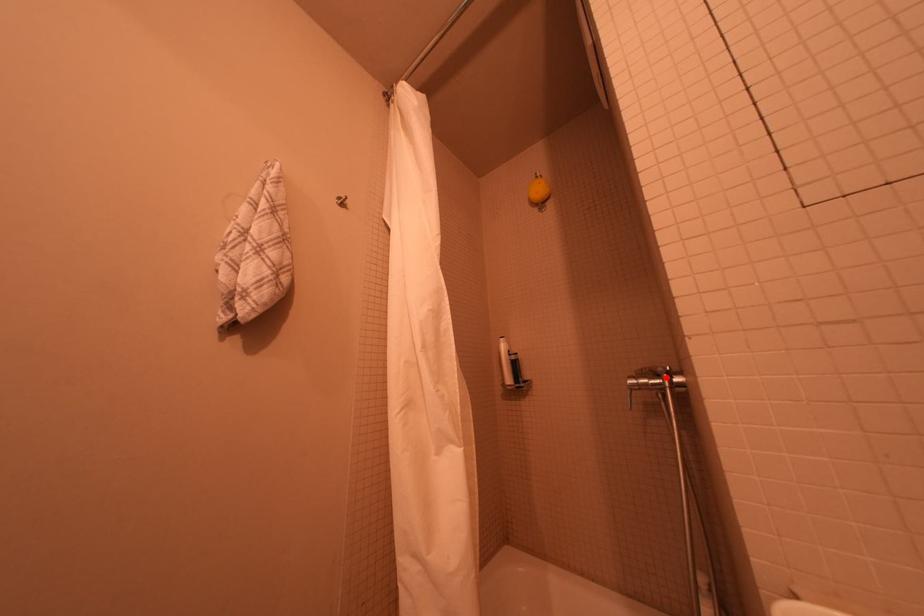
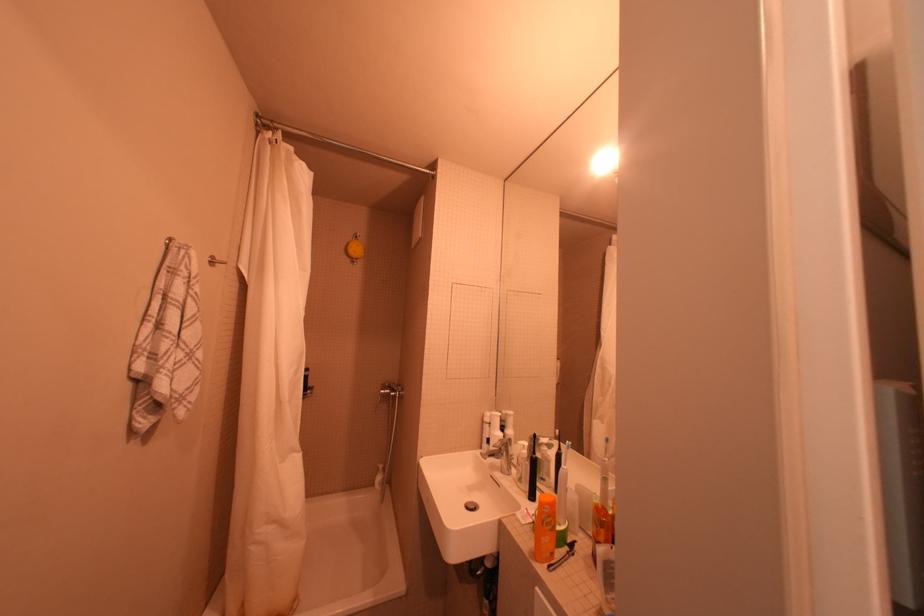
Question: I am providing you with two images of the same scene from different viewpoints. A red point is shown in image1. For the corresponding object point in image2, is it positioned nearer or farther from the camera?

Choices:
 (A) Nearer
 (B) Farther

Answer: (B)